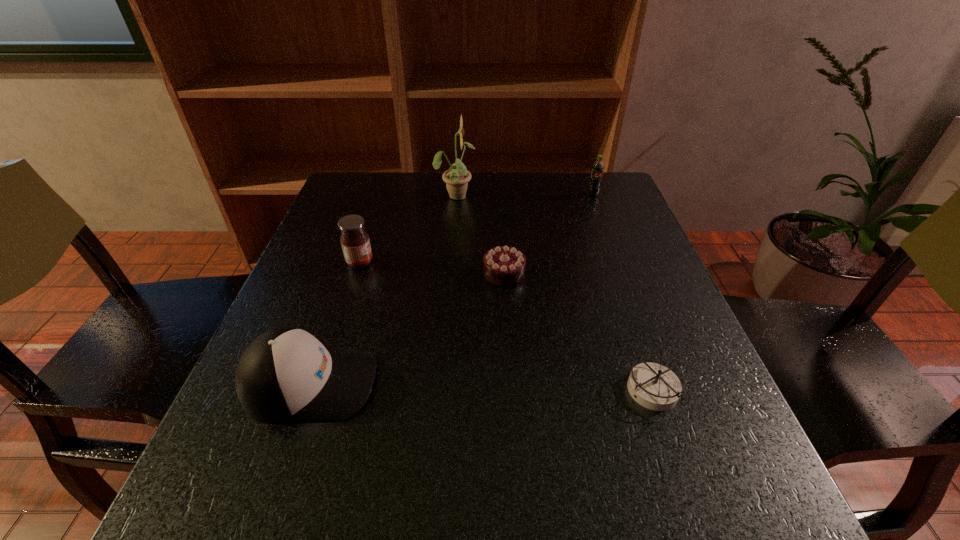
Locate an element on the screen. free region that satisfies the following two spatial constraints: 1. on the front-facing side of the compass; 2. on the right side of the tallest object is located at coordinates (441, 391).

You are a GUI agent. You are given a task and a screenshot of the screen. Output one action in this format:
    pyautogui.click(x=<x>, y=<y>)
    Task: Click on the vacant space that satisfies the following two spatial constraints: 1. on the label side of the jam; 2. on the left side of the compass
    
    Given the screenshot: What is the action you would take?
    pyautogui.click(x=319, y=391)

Where is `blank space that satisfies the following two spatial constraints: 1. on the back side of the compass; 2. on the front panel of the cap`? blank space that satisfies the following two spatial constraints: 1. on the back side of the compass; 2. on the front panel of the cap is located at coordinates (651, 383).

The height and width of the screenshot is (540, 960). What are the coordinates of `vacant space that satisfies the following two spatial constraints: 1. on the front-facing side of the tallest object; 2. on the left side of the compass` in the screenshot? It's located at (441, 391).